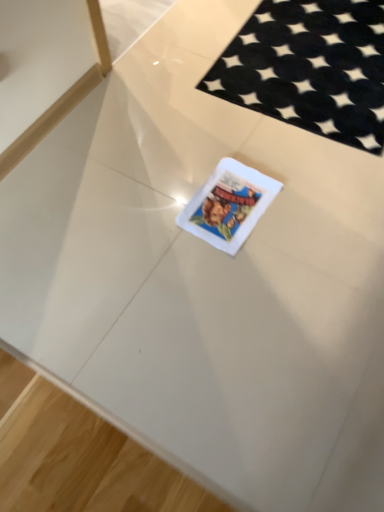
Where is `blank space situated above white matte card at center (from a real-world perspective)`? blank space situated above white matte card at center (from a real-world perspective) is located at coordinates (230, 201).